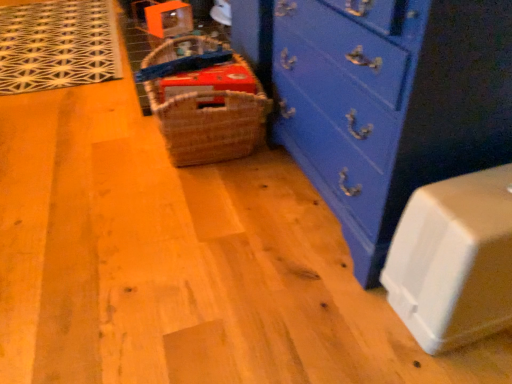
Question: Choose the correct answer: Is blue painted wood chest of drawers at center inside white plastic container at lower right or outside it?

Choices:
 (A) inside
 (B) outside

Answer: (B)

Question: From the image's perspective, relative to white plastic container at lower right, is blue painted wood chest of drawers at center above or below?

Choices:
 (A) above
 (B) below

Answer: (A)

Question: Which of these objects is positioned closest to the woven brown basket at center?

Choices:
 (A) white plastic container at lower right
 (B) blue painted wood chest of drawers at center

Answer: (B)

Question: Which is nearer to the white plastic container at lower right?

Choices:
 (A) blue painted wood chest of drawers at center
 (B) woven brown basket at center

Answer: (A)